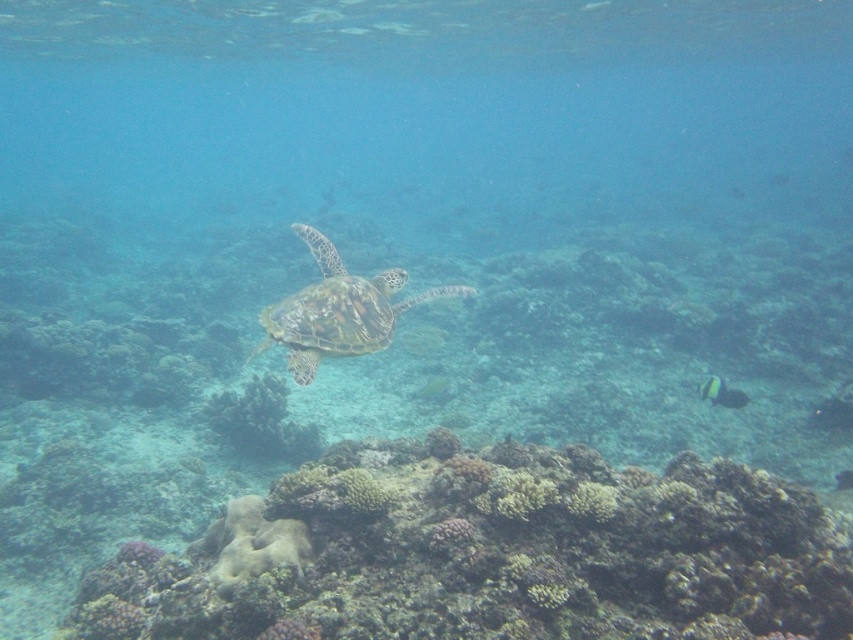
Is rough textured coral reef at center closer to camera compared to green textured coral at center?

Yes, it is.

Between rough textured coral reef at center and green textured coral at center, which one is positioned higher?

rough textured coral reef at center is above.

Image resolution: width=853 pixels, height=640 pixels. Find the location of `rough textured coral reef at center`. rough textured coral reef at center is located at coordinates (489, 554).

Is rough textured coral reef at center below black glossy fish at lower right?

Indeed, rough textured coral reef at center is positioned under black glossy fish at lower right.

Is rough textured coral reef at center closer to the viewer compared to black glossy fish at lower right?

That is True.

Describe the element at coordinates (489, 554) in the screenshot. I see `rough textured coral reef at center` at that location.

This screenshot has height=640, width=853. I want to click on rough textured coral reef at center, so click(x=489, y=554).

Can you confirm if rough textured coral reef at center is thinner than green textured shell at center?

No.

Is rough textured coral reef at center positioned before green textured shell at center?

That is True.

Does point (672, 616) come in front of point (384, 272)?

Yes, it is in front of point (384, 272).

Find the location of a particular element. Image resolution: width=853 pixels, height=640 pixels. rough textured coral reef at center is located at coordinates (489, 554).